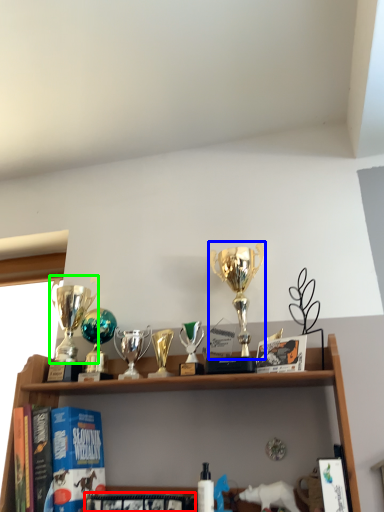
Question: Which object is positioned farthest from book (highlighted by a red box)? Select from trophy (highlighted by a blue box) and trophy (highlighted by a green box).

Choices:
 (A) trophy
 (B) trophy

Answer: (A)